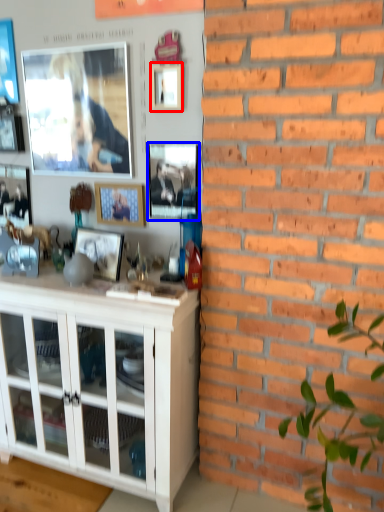
Question: Which of the following is the closest to the observer, picture frame (highlighted by a red box) or picture frame (highlighted by a blue box)?

Choices:
 (A) picture frame
 (B) picture frame

Answer: (A)